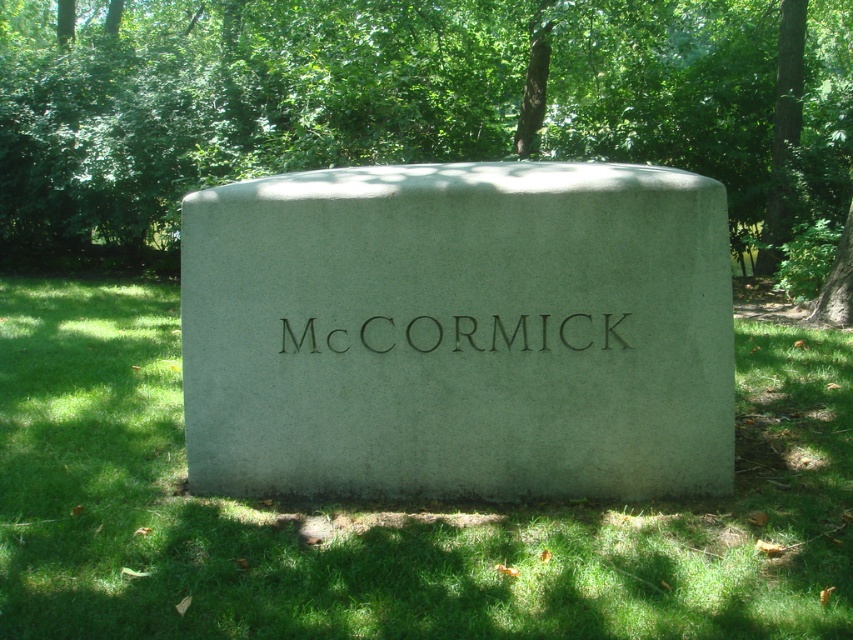
Who is more forward, [624,312] or [117,612]?

Point [117,612]

Image resolution: width=853 pixels, height=640 pixels. I want to click on gray concrete gravestone at center, so click(x=457, y=332).

Measure the distance from green grass at center to blackmaterial/texturetext at center.

They are 37.23 inches apart.

Does point (91, 365) come farther from viewer compared to point (523, 326)?

Yes, point (91, 365) is farther from viewer.

Does point (51, 449) come in front of point (440, 326)?

No, (51, 449) is further to viewer.

The image size is (853, 640). I want to click on green grass at center, so click(390, 509).

Is green leafy tree at center shorter than green grass at center?

Incorrect, green leafy tree at center's height does not fall short of green grass at center's.

Between green leafy tree at center and green grass at center, which one is positioned lower?

green grass at center

What do you see at coordinates (422, 109) in the screenshot? I see `green leafy tree at center` at bounding box center [422, 109].

The image size is (853, 640). Identify the location of green leafy tree at center. (422, 109).